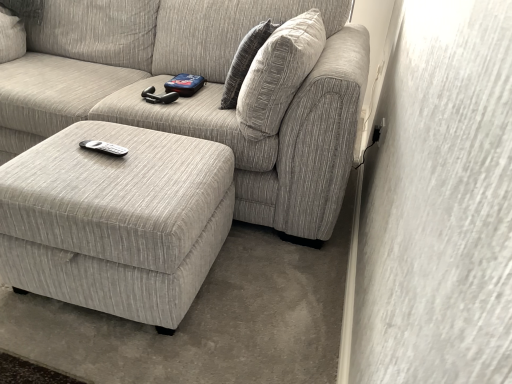
Question: Would you consider matte gray ottoman at lower left to be distant from textured beige couch at center?

Choices:
 (A) no
 (B) yes

Answer: (A)

Question: Is matte gray ottoman at lower left thinner than textured beige couch at center?

Choices:
 (A) no
 (B) yes

Answer: (B)

Question: Is matte gray ottoman at lower left aimed at textured beige couch at center?

Choices:
 (A) no
 (B) yes

Answer: (A)

Question: Is textured beige couch at center inside matte gray ottoman at lower left?

Choices:
 (A) yes
 (B) no

Answer: (B)

Question: Is matte gray ottoman at lower left positioned with its back to textured beige couch at center?

Choices:
 (A) yes
 (B) no

Answer: (A)

Question: From the image's perspective, is matte gray ottoman at lower left located beneath textured beige couch at center?

Choices:
 (A) yes
 (B) no

Answer: (A)

Question: From a real-world perspective, is textured gray pillow at upper right located beneath textured beige couch at center?

Choices:
 (A) no
 (B) yes

Answer: (A)

Question: Does textured gray pillow at upper right have a greater width compared to textured beige couch at center?

Choices:
 (A) yes
 (B) no

Answer: (B)

Question: Can you confirm if textured gray pillow at upper right is positioned to the right of textured beige couch at center?

Choices:
 (A) yes
 (B) no

Answer: (A)

Question: Can you confirm if textured gray pillow at upper right is smaller than textured beige couch at center?

Choices:
 (A) yes
 (B) no

Answer: (A)

Question: Is the position of textured gray pillow at upper right more distant than that of textured beige couch at center?

Choices:
 (A) no
 (B) yes

Answer: (B)

Question: From the image's perspective, would you say textured gray pillow at upper right is positioned over textured beige couch at center?

Choices:
 (A) yes
 (B) no

Answer: (B)

Question: Does textured beige couch at center come behind textured gray pillow at upper right?

Choices:
 (A) no
 (B) yes

Answer: (A)